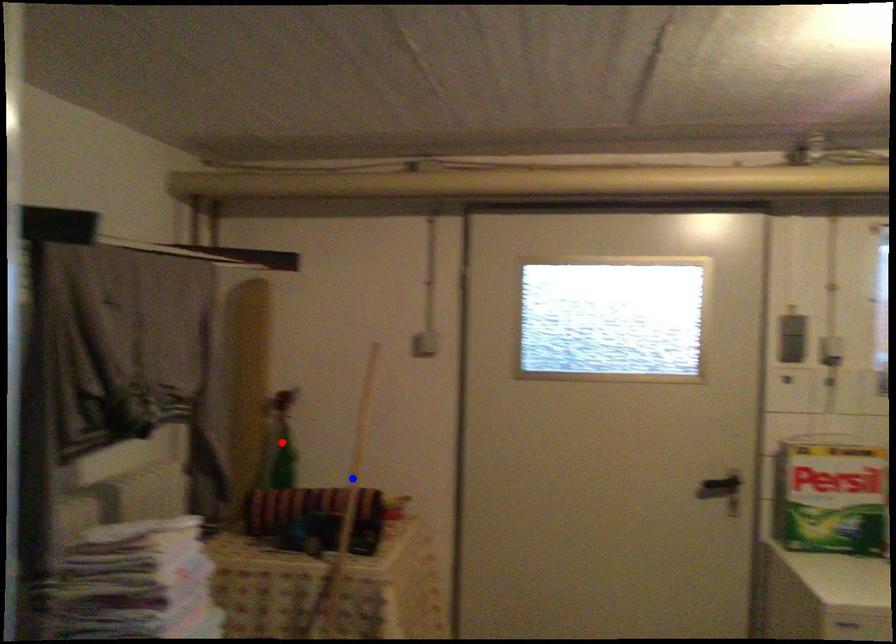
Question: Two points are marked on the image. Which point is closer to the camera?

Choices:
 (A) Blue point is closer.
 (B) Red point is closer.

Answer: (A)